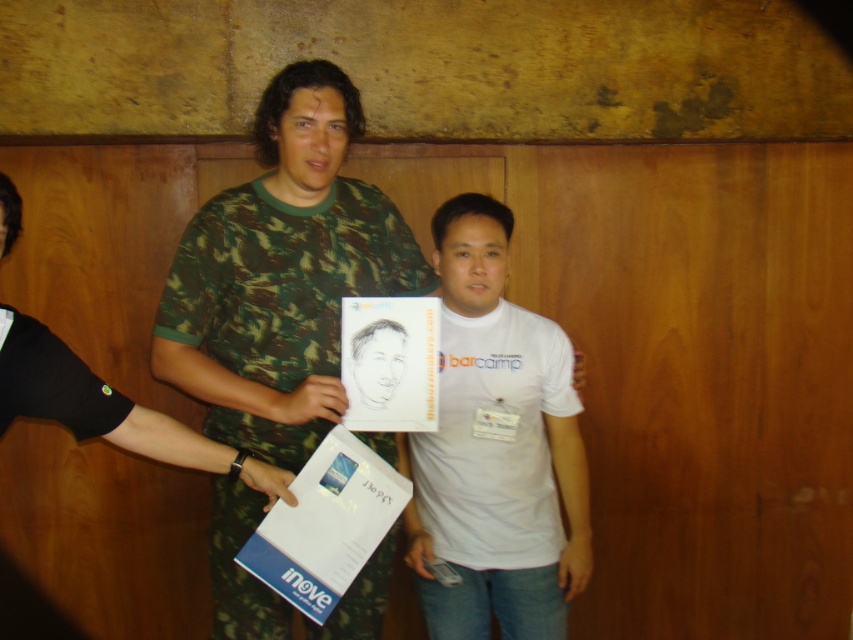
Can you confirm if camo fabric shirt at center is smaller than white matte t-shirt at center?

Incorrect, camo fabric shirt at center is not smaller in size than white matte t-shirt at center.

Does point (183, 348) lie behind point (433, 620)?

No, it is not.

At what (x,y) coordinates should I click in order to perform the action: click on camo fabric shirt at center. Please return your answer as a coordinate pair (x, y). This screenshot has height=640, width=853. Looking at the image, I should click on (282, 275).

Describe the element at coordinates (282, 275) in the screenshot. Image resolution: width=853 pixels, height=640 pixels. I see `camo fabric shirt at center` at that location.

Does point (161, 321) lie behind point (375, 406)?

Yes, point (161, 321) is farther from viewer.

You are a GUI agent. You are given a task and a screenshot of the screen. Output one action in this format:
    pyautogui.click(x=<x>, y=<y>)
    Task: Click on the camo fabric shirt at center
    This screenshot has width=853, height=640.
    Given the screenshot: What is the action you would take?
    pyautogui.click(x=282, y=275)

Can you confirm if camouflage fabric shirt at center is positioned below smooth paper portrait at center?

Yes.

Can you confirm if camouflage fabric shirt at center is thinner than smooth paper portrait at center?

No, camouflage fabric shirt at center is not thinner than smooth paper portrait at center.

Between point (146, 422) and point (386, 358), which one is positioned behind?

The point (386, 358) is behind.

Where is `camouflage fabric shirt at center`? camouflage fabric shirt at center is located at coordinates (109, 410).